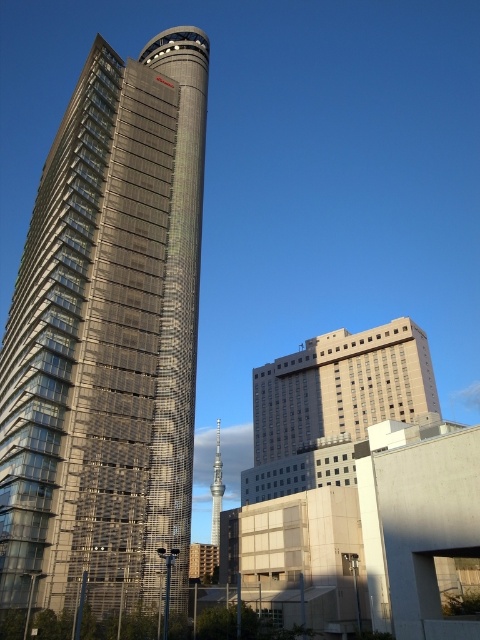
Is point (308, 352) more distant than point (219, 452)?

No, it is not.

Can you confirm if beige concrete building at center is taller than glassy metallic tower at center?

In fact, beige concrete building at center may be shorter than glassy metallic tower at center.

Locate an element on the screen. The height and width of the screenshot is (640, 480). beige concrete building at center is located at coordinates (342, 388).

Find the location of a particular element. This screenshot has width=480, height=640. beige concrete building at center is located at coordinates (342, 388).

Does metallic glass skyscraper at center have a greater height compared to beige concrete building at center?

Yes, metallic glass skyscraper at center is taller than beige concrete building at center.

Between metallic glass skyscraper at center and beige concrete building at center, which one is positioned higher?

metallic glass skyscraper at center is higher up.

Who is more distant from viewer, (27, 369) or (271, 369)?

The point (271, 369) is behind.

Where is `metallic glass skyscraper at center`? The image size is (480, 640). metallic glass skyscraper at center is located at coordinates (108, 339).

Does metallic glass skyscraper at center have a lesser height compared to glassy metallic tower at center?

Yes, metallic glass skyscraper at center is shorter than glassy metallic tower at center.

Is metallic glass skyscraper at center thinner than glassy metallic tower at center?

No.

Which is in front, point (83, 499) or point (216, 429)?

Point (83, 499) is more forward.

This screenshot has height=640, width=480. What are the coordinates of `metallic glass skyscraper at center` in the screenshot? It's located at (108, 339).